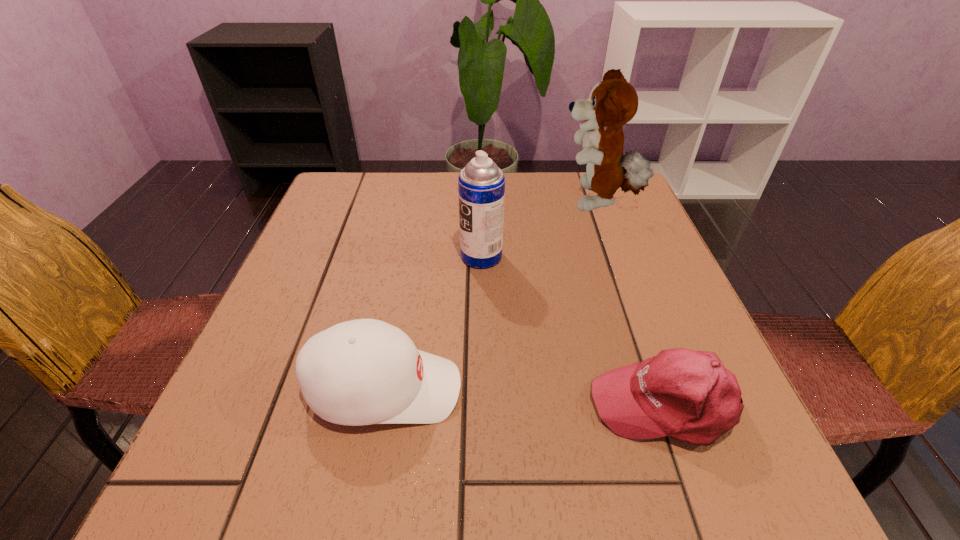
The width and height of the screenshot is (960, 540). I want to click on puppy, so click(x=613, y=102).

Locate an element on the screen. This screenshot has height=540, width=960. the tallest object is located at coordinates (613, 102).

Find the location of `the third nearest object`. the third nearest object is located at coordinates (481, 184).

The image size is (960, 540). I want to click on aerosol can, so click(481, 184).

Where is `the second shortest object`? This screenshot has height=540, width=960. the second shortest object is located at coordinates pos(365,371).

The width and height of the screenshot is (960, 540). Identify the location of the taller baseball cap. (365, 371).

Identify the location of the shorter baseball cap. (688, 395).

Locate an element on the screen. This screenshot has height=540, width=960. the right baseball cap is located at coordinates (688, 395).

Locate an element on the screen. vacant space located on the face of the puppy is located at coordinates (415, 202).

You are a GUI agent. You are given a task and a screenshot of the screen. Output one action in this format:
    pyautogui.click(x=<x>, y=<y>)
    Task: Click on the free space located on the face of the puppy
    The height and width of the screenshot is (540, 960).
    Given the screenshot: What is the action you would take?
    pyautogui.click(x=476, y=202)